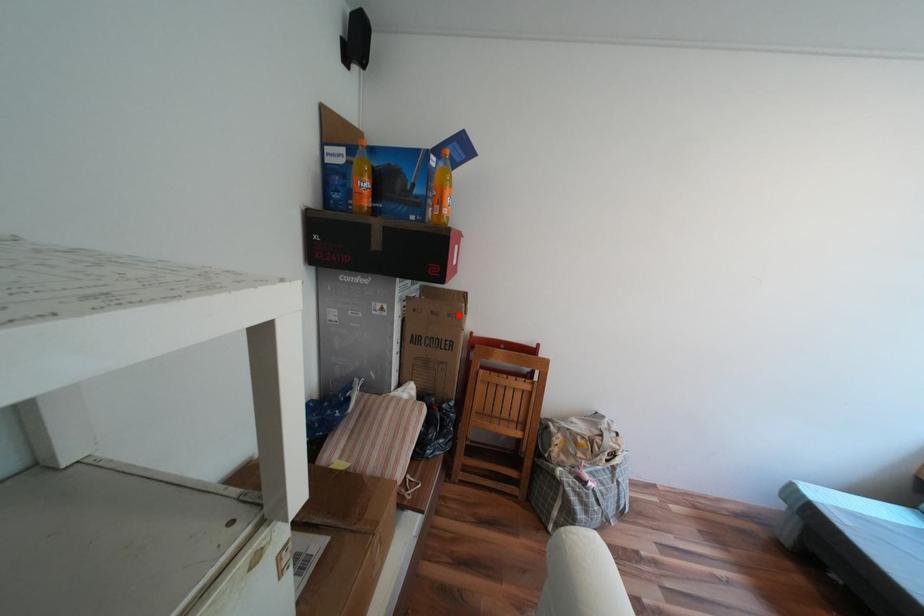
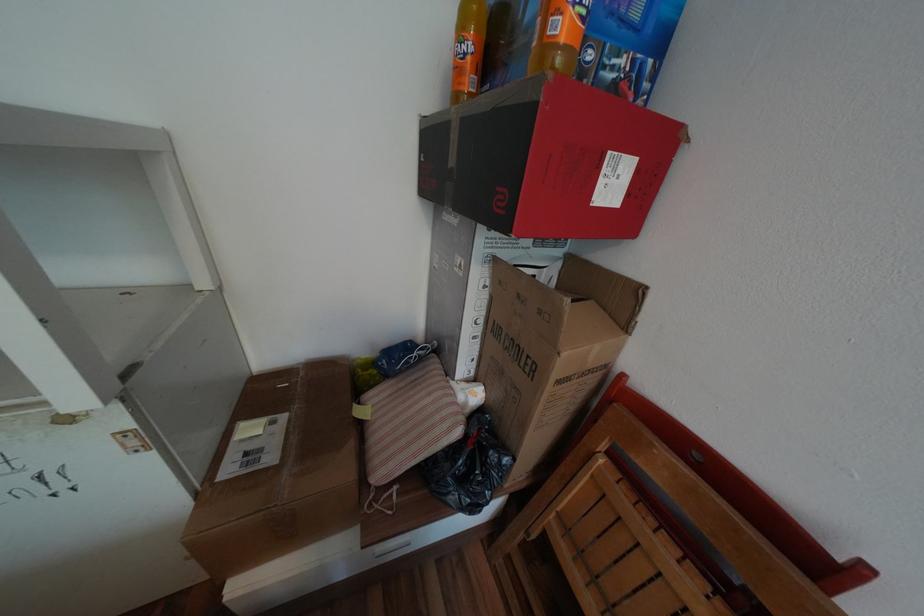
Locate, in the second image, the point that corresponds to the highlighted location in the first image.

(550, 312)